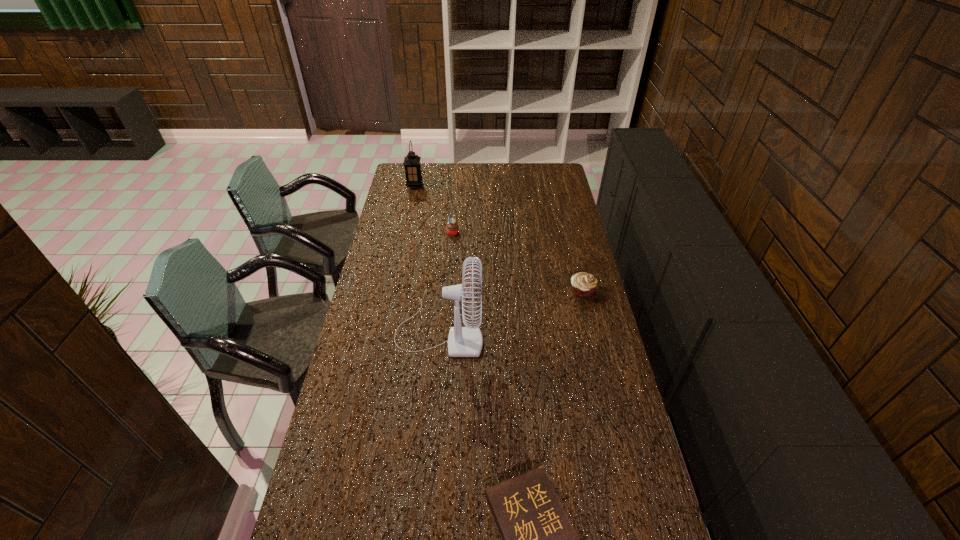
Where is `free space located 0.270m on the front of the nearer muffin`? free space located 0.270m on the front of the nearer muffin is located at coordinates (598, 357).

At what (x,y) coordinates should I click in order to perform the action: click on object situated at the far edge. Please return your answer as a coordinate pair (x, y). Looking at the image, I should click on (411, 162).

At what (x,y) coordinates should I click in order to perform the action: click on fan that is at the left edge. Please return your answer as a coordinate pair (x, y). This screenshot has width=960, height=540. Looking at the image, I should click on (467, 341).

This screenshot has height=540, width=960. What are the coordinates of `lantern present at the left edge` in the screenshot? It's located at (411, 162).

Identify the location of object present at the right edge. Image resolution: width=960 pixels, height=540 pixels. pyautogui.click(x=583, y=284).

I want to click on object that is positioned at the far left corner, so click(x=411, y=162).

In the image, there is a desktop. At what (x,y) coordinates should I click in order to perform the action: click on free space at the far edge. Please return your answer as a coordinate pair (x, y). The width and height of the screenshot is (960, 540). Looking at the image, I should click on (511, 165).

I want to click on free region at the left edge of the desktop, so click(x=386, y=222).

Where is `vacant space at the far right corner of the desktop`? This screenshot has width=960, height=540. vacant space at the far right corner of the desktop is located at coordinates (558, 183).

Find the location of `free area in between the lantern and the right muffin`. free area in between the lantern and the right muffin is located at coordinates (498, 239).